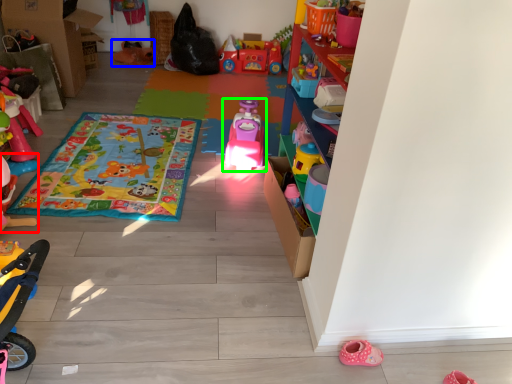
Question: Which object is positioned farthest from toy (highlighted by a red box)? Select from toy (highlighted by a blue box) and toy (highlighted by a green box).

Choices:
 (A) toy
 (B) toy

Answer: (A)